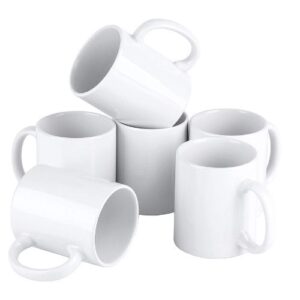
Locate an element on the screen. This screenshot has width=300, height=300. coffee mug is located at coordinates (213, 197), (255, 136), (147, 151), (146, 115), (80, 155), (69, 202).